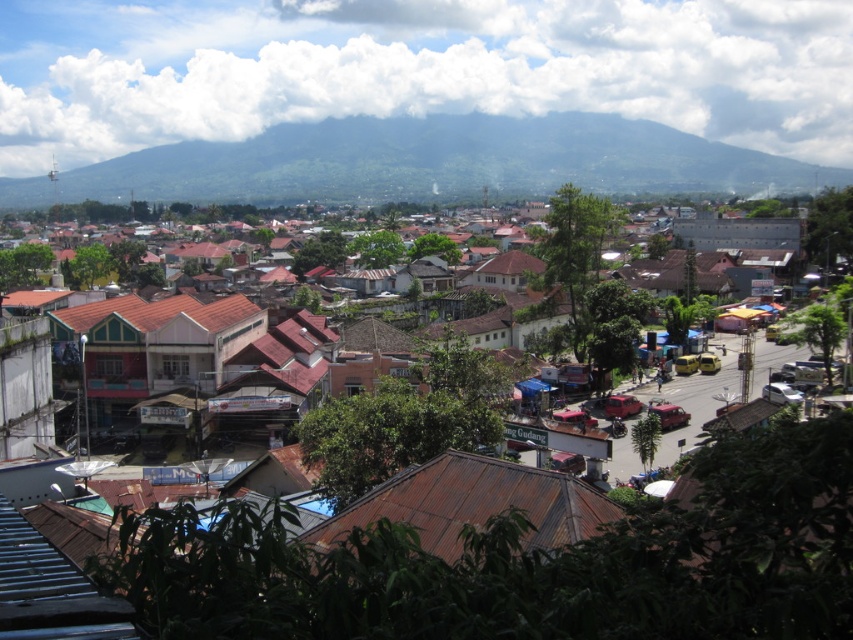
Question: Is the position of brown corrugated metal roofs at center more distant than that of green forested mountain at upper center?

Choices:
 (A) no
 (B) yes

Answer: (A)

Question: Does brown corrugated metal roofs at center appear on the right side of green forested mountain at upper center?

Choices:
 (A) no
 (B) yes

Answer: (B)

Question: Which object is closer to the camera taking this photo?

Choices:
 (A) brown corrugated metal roofs at center
 (B) green forested mountain at upper center

Answer: (A)

Question: Is brown corrugated metal roofs at center below green forested mountain at upper center?

Choices:
 (A) no
 (B) yes

Answer: (B)

Question: Among these objects, which one is nearest to the camera?

Choices:
 (A) brown corrugated metal roofs at center
 (B) green forested mountain at upper center

Answer: (A)